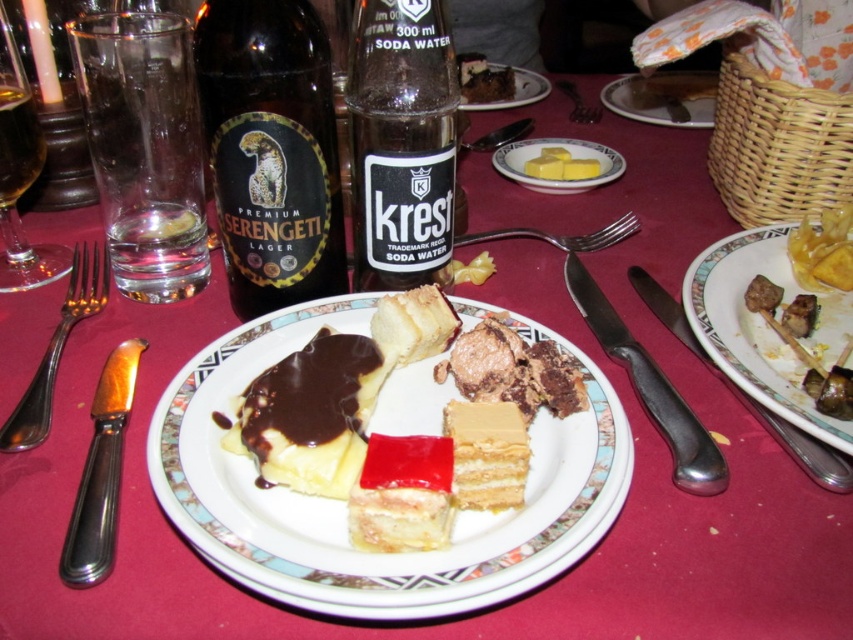
Question: Considering the relative positions of matte ceramic plate at lower right and spongy white cake at center in the image provided, where is matte ceramic plate at lower right located with respect to spongy white cake at center?

Choices:
 (A) left
 (B) right

Answer: (B)

Question: Based on their relative distances, which object is farther from the matte ceramic plate at lower right?

Choices:
 (A) matte white plate at upper center
 (B) clear glass at left

Answer: (A)

Question: Which object is closer to the camera taking this photo?

Choices:
 (A) yellow sponge cake at center
 (B) silvermetallicfork at left

Answer: (A)

Question: Which point is closer to the camera?

Choices:
 (A) silver metallic fork at upper right
 (B) clear glass at left
 (C) black glass bottle at center

Answer: (C)

Question: Does semi-glossy chocolate cake at center appear under translucent glass at upper left?

Choices:
 (A) no
 (B) yes

Answer: (B)

Question: Is semi-glossy chocolate cake at center thinner than silver metallic fork at upper center?

Choices:
 (A) yes
 (B) no

Answer: (B)